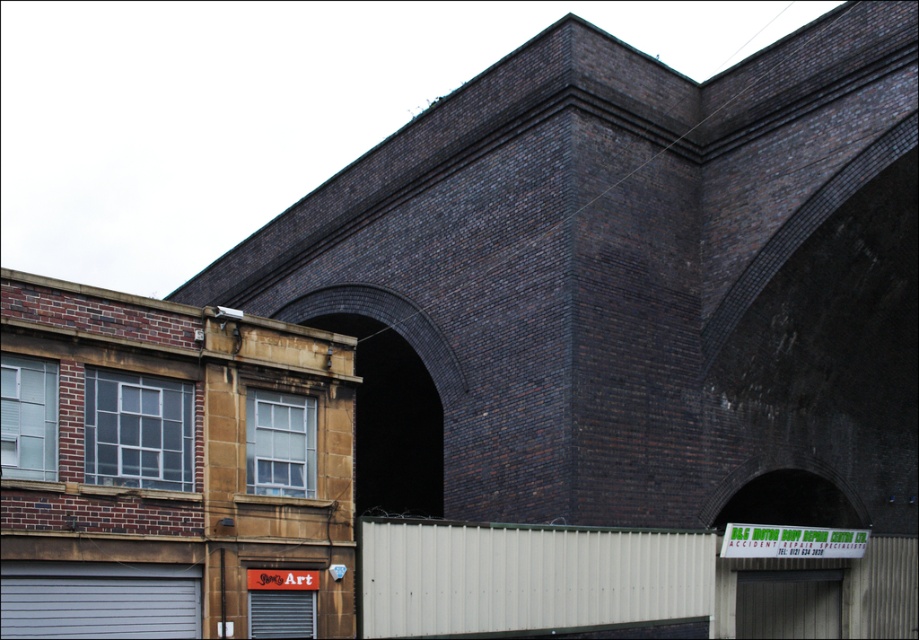
You are standing at the entrance of the two story building on the left and want to walk towards the dark brick archway at center. In which direction should you head?

You should head towards the right direction since the dark brick archway at center is located to the right side of the two story building on the left.

You are standing in front of the two architectural structures described. You want to take a photo that captures both the two story red brick building on the left and the dark brick archway at center. Given that your camera has a maximum focal length that allows capturing objects up to 40 meters away, will you be able to include both structures in the same photo?

The dark brick archway at center is 37.63 meters away from the viewer. Since the camera can capture up to 40 meters, and the two story red brick building on the left is closer than the archway, both structures can be included in the same photo.

You are a delivery person trying to drive a truck that is 3 meters tall through the dark brick archway at center and the gray matte garage door at lower left. Which one can your truck pass through without hitting the top?

The dark brick archway at center is much taller than the gray matte garage door at lower left, so the truck can pass through the dark brick archway at center without hitting the top.